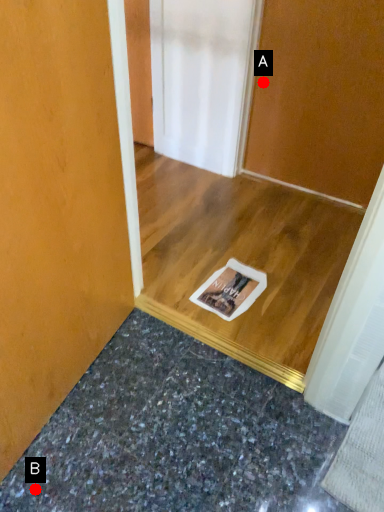
Question: Two points are circled on the image, labeled by A and B beside each circle. Which point is closer to the camera?

Choices:
 (A) A is closer
 (B) B is closer

Answer: (B)